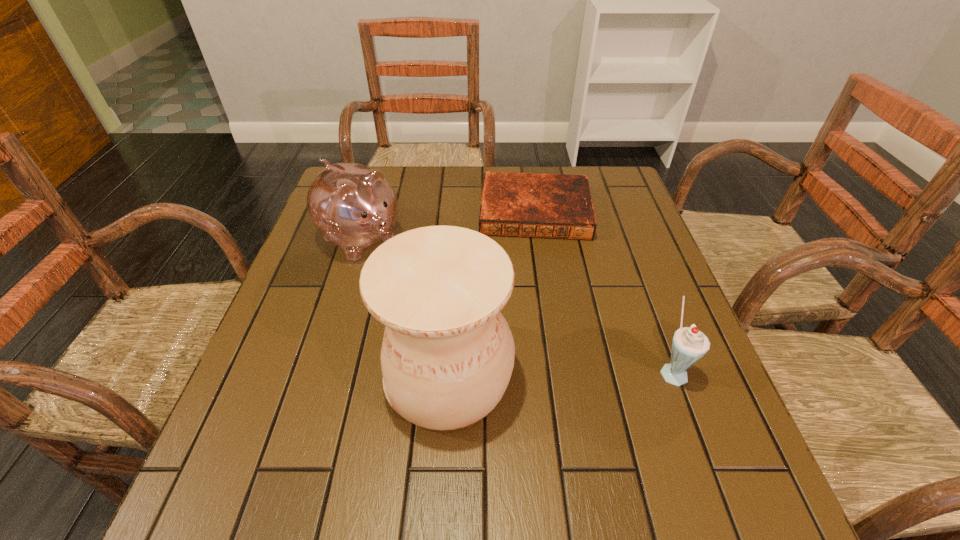
You are a GUI agent. You are given a task and a screenshot of the screen. Output one action in this format:
    pyautogui.click(x=<x>, y=<y>)
    Task: Click on the empty location between the Bible and the milkshake
    The height and width of the screenshot is (540, 960).
    Given the screenshot: What is the action you would take?
    pyautogui.click(x=604, y=291)

Locate an element on the screen. Image resolution: width=960 pixels, height=540 pixels. vacant area that lies between the milkshake and the Bible is located at coordinates (604, 291).

Identify which object is the third nearest to the piggy bank. Please provide its 2D coordinates. Your answer should be formatted as a tuple, i.e. [(x, y)], where the tuple contains the x and y coordinates of a point satisfying the conditions above.

[(689, 344)]

Select which object appears as the second closest to the piggy bank. Please provide its 2D coordinates. Your answer should be formatted as a tuple, i.e. [(x, y)], where the tuple contains the x and y coordinates of a point satisfying the conditions above.

[(555, 206)]